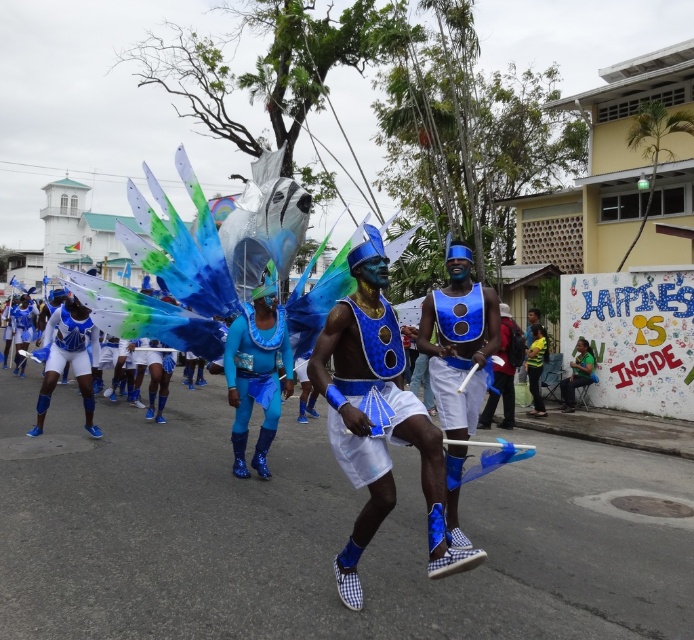
You are a photographer trying to capture the vibrant street parade. You notice two points marked in the image. The first point is at coordinates point (366, 417) and the second is at point (448, 545). Which point should you focus on to ensure the subject is closer to the camera?

Point (366, 417) is in front of point (448, 545), so focusing on point (366, 417) will ensure the subject is closer to the camera.

From the picture: You are a photographer at the parade and want to capture both the matte blue costume at center and the matte blue fabric at center in a single shot. Since you want the costume to stand out, which object should you position closer to the camera to emphasize its height?

The matte blue costume at center is taller than the matte blue fabric at center. To make the costume stand out due to its height, position the matte blue costume at center closer to the camera.

You are a photographer at the parade and want to capture a closeup shot of the matte blue costume at center and the matte blue fabric at center without any blur. The camera can focus on objects within a 30 inch range. Can you fit both in the focus range?

The matte blue costume at center and the matte blue fabric at center are 35.51 inches apart from each other. Since the camera can only focus on objects within a 30 inch range, the distance between them exceeds the focus range, so you cannot capture both in focus without adjusting your position or equipment.